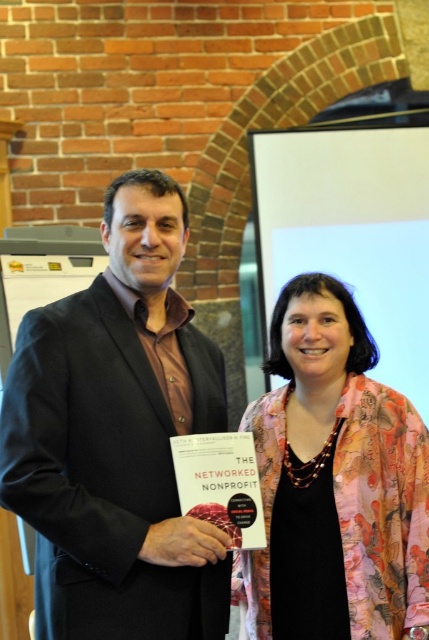
Can you confirm if black matte suit at left is positioned to the right of floral silk jacket at center?

No, black matte suit at left is not to the right of floral silk jacket at center.

Between point (124, 472) and point (356, 497), which one is positioned behind?

Positioned behind is point (356, 497).

You are a GUI agent. You are given a task and a screenshot of the screen. Output one action in this format:
    pyautogui.click(x=<x>, y=<y>)
    Task: Click on the black matte suit at left
    
    Given the screenshot: What is the action you would take?
    pyautogui.click(x=117, y=436)